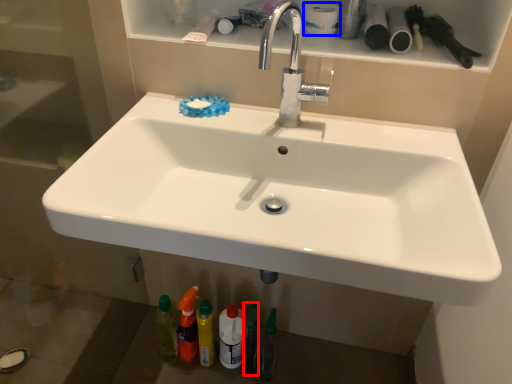
Question: Which object is further to the camera taking this photo, toiletry (highlighted by a red box) or toilet paper (highlighted by a blue box)?

Choices:
 (A) toiletry
 (B) toilet paper

Answer: (A)